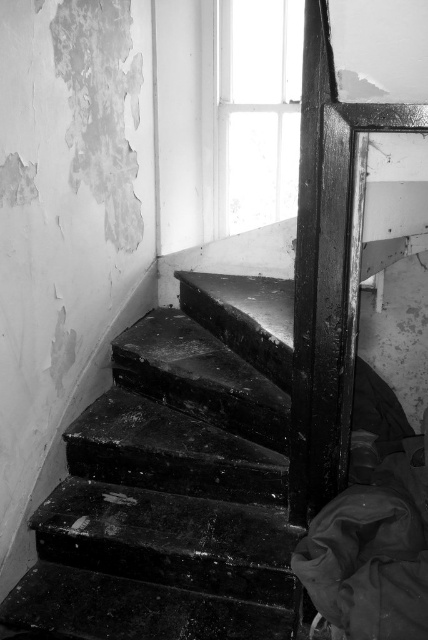
Does black glossy stairs at center appear on the right side of transparent glass window at upper center?

No, black glossy stairs at center is not to the right of transparent glass window at upper center.

From the picture: Who is more distant from viewer, (267, 385) or (246, 8)?

The point (246, 8) is behind.

Image resolution: width=428 pixels, height=640 pixels. Identify the location of black glossy stairs at center. coord(175,481).